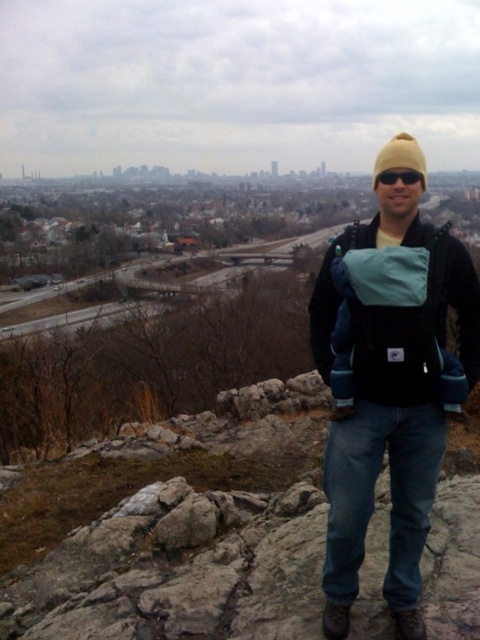
Question: Does black fleece jacket at center appear on the right side of beige knit beanie at upper center?

Choices:
 (A) yes
 (B) no

Answer: (B)

Question: Which point appears closest to the camera in this image?

Choices:
 (A) (386, 172)
 (B) (376, 173)

Answer: (A)

Question: Does black fleece jacket at center lie in front of black plastic sunglasses at center?

Choices:
 (A) yes
 (B) no

Answer: (A)

Question: Considering the real-world distances, which object is farthest from the beige knit beanie at upper center?

Choices:
 (A) black fleece jacket at center
 (B) black plastic sunglasses at center

Answer: (B)

Question: Where is black fleece jacket at center located in relation to black plastic sunglasses at center in the image?

Choices:
 (A) right
 (B) left

Answer: (B)

Question: Which object appears farthest from the camera in this image?

Choices:
 (A) black plastic sunglasses at center
 (B) black fleece jacket at center

Answer: (A)